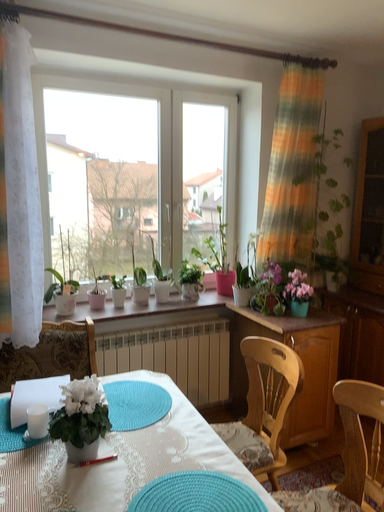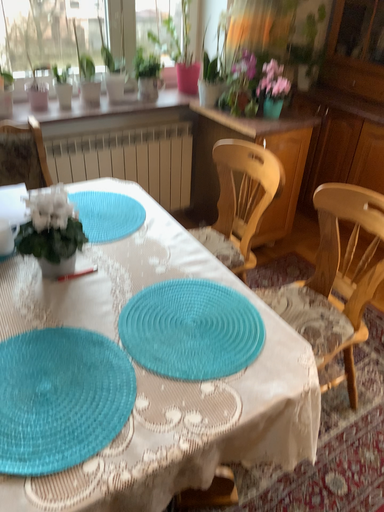
Question: How did the camera likely rotate when shooting the video?

Choices:
 (A) rotated right
 (B) rotated left

Answer: (A)